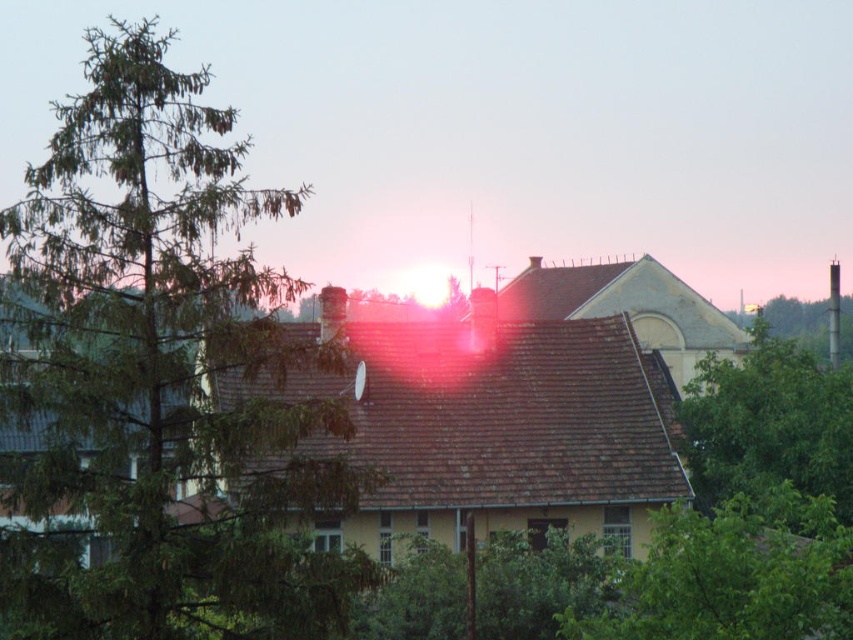
You are standing in front of the yellow house with a brown tiled roof. You notice two green leafy trees in the scene. Which tree, the green leafy tree at right or the green leafy tree at center, is positioned higher in the image?

The green leafy tree at right is positioned higher in the image than the green leafy tree at center.